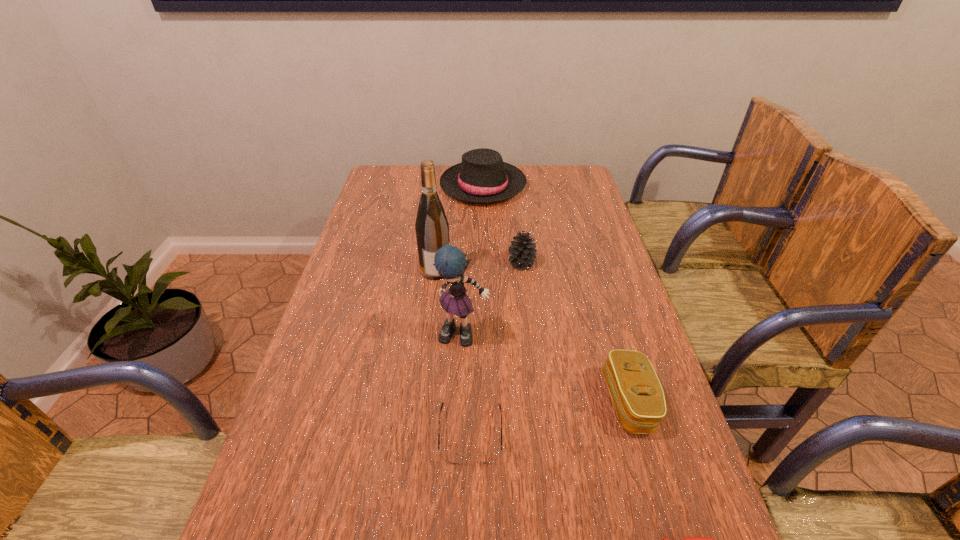
The width and height of the screenshot is (960, 540). Find the location of `free spot between the rag doll and the dress hat`. free spot between the rag doll and the dress hat is located at coordinates (473, 260).

Identify the location of vacant point located between the rag doll and the spectacles. The image size is (960, 540). (468, 386).

This screenshot has width=960, height=540. Find the location of `empty space between the wine bottle and the pinecone`. empty space between the wine bottle and the pinecone is located at coordinates pyautogui.click(x=479, y=267).

Where is `free space between the second tallest object and the farthest object`? This screenshot has width=960, height=540. free space between the second tallest object and the farthest object is located at coordinates (473, 260).

Locate which object ranks sixth in proximity to the pinecone. Please provide its 2D coordinates. Your answer should be formatted as a tuple, i.e. [(x, y)], where the tuple contains the x and y coordinates of a point satisfying the conditions above.

[(691, 539)]

Where is `object that is the fifth closest to the spectacles`? object that is the fifth closest to the spectacles is located at coordinates (522, 251).

Find the location of a particular element. blank area in the image that satisfies the following two spatial constraints: 1. on the back side of the wine bottle; 2. on the right side of the pinecone is located at coordinates (437, 264).